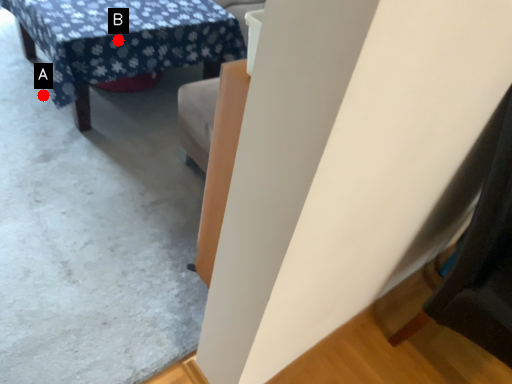
Question: Two points are circled on the image, labeled by A and B beside each circle. Which point is further to the camera?

Choices:
 (A) A is further
 (B) B is further

Answer: (A)